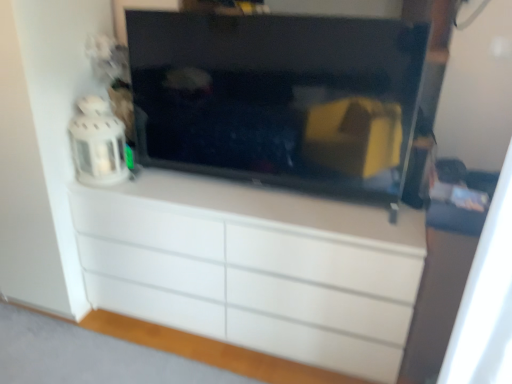
Question: Is white glossy chest of drawers at center closer to the viewer compared to black glossy tv at center?

Choices:
 (A) yes
 (B) no

Answer: (B)

Question: Is there a large distance between white glossy chest of drawers at center and black glossy tv at center?

Choices:
 (A) yes
 (B) no

Answer: (B)

Question: Does white glossy chest of drawers at center appear on the left side of black glossy tv at center?

Choices:
 (A) yes
 (B) no

Answer: (A)

Question: Considering the relative positions of white glossy chest of drawers at center and black glossy tv at center in the image provided, is white glossy chest of drawers at center behind black glossy tv at center?

Choices:
 (A) no
 (B) yes

Answer: (B)

Question: Does white glossy chest of drawers at center contain black glossy tv at center?

Choices:
 (A) no
 (B) yes

Answer: (A)

Question: Is white glossy chest of drawers at center taller or shorter than white fabric curtain at right?

Choices:
 (A) tall
 (B) short

Answer: (B)

Question: Based on their positions, is white glossy chest of drawers at center located to the left or right of white fabric curtain at right?

Choices:
 (A) left
 (B) right

Answer: (A)

Question: From the image's perspective, is white glossy chest of drawers at center located above or below white fabric curtain at right?

Choices:
 (A) above
 (B) below

Answer: (B)

Question: Relative to white fabric curtain at right, is white glossy chest of drawers at center in front or behind?

Choices:
 (A) behind
 (B) front

Answer: (A)

Question: From the image's perspective, is black glossy tv at center positioned above or below white fabric curtain at right?

Choices:
 (A) above
 (B) below

Answer: (A)

Question: From a real-world perspective, is black glossy tv at center positioned above or below white fabric curtain at right?

Choices:
 (A) below
 (B) above

Answer: (B)

Question: Is black glossy tv at center bigger or smaller than white fabric curtain at right?

Choices:
 (A) small
 (B) big

Answer: (B)

Question: Is black glossy tv at center inside the boundaries of white fabric curtain at right, or outside?

Choices:
 (A) inside
 (B) outside

Answer: (B)

Question: Considering the positions of white glossy chest of drawers at center and black glossy tv at center in the image, is white glossy chest of drawers at center bigger or smaller than black glossy tv at center?

Choices:
 (A) big
 (B) small

Answer: (A)

Question: Choose the correct answer: Is white glossy chest of drawers at center inside black glossy tv at center or outside it?

Choices:
 (A) inside
 (B) outside

Answer: (B)